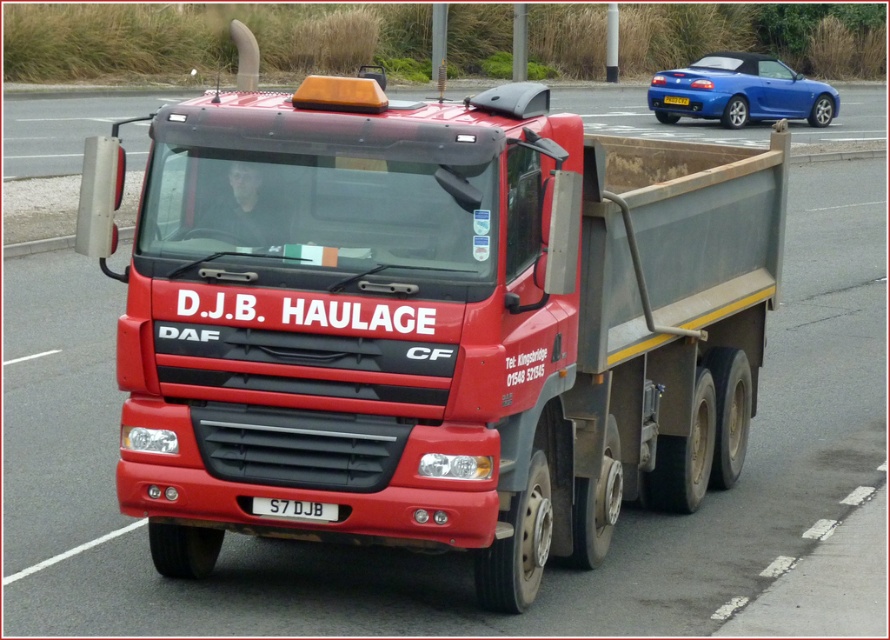
You are a traffic officer observing the road. You see a matte red truck at center and a blue metallic car at upper right. Which vehicle is smaller in size?

The matte red truck at center has a smaller size compared to the blue metallic car at upper right, so the matte red truck at center is smaller.

What are the coordinates of the matte red truck at center?

The coordinates of the matte red truck at center are point (430, 323).

You are a delivery driver who needs to attach a GPS tracker to your matte red truck at center. The GPS tracker has a range of 2 meters. If you place the tracker at the position of the white plastic license plate at center, will the tracker be able to communicate with the truck?

The matte red truck at center and white plastic license plate at center are 2.44 meters apart. Since the GPS tracker has a 2 meter range, it will not be able to communicate with the truck.